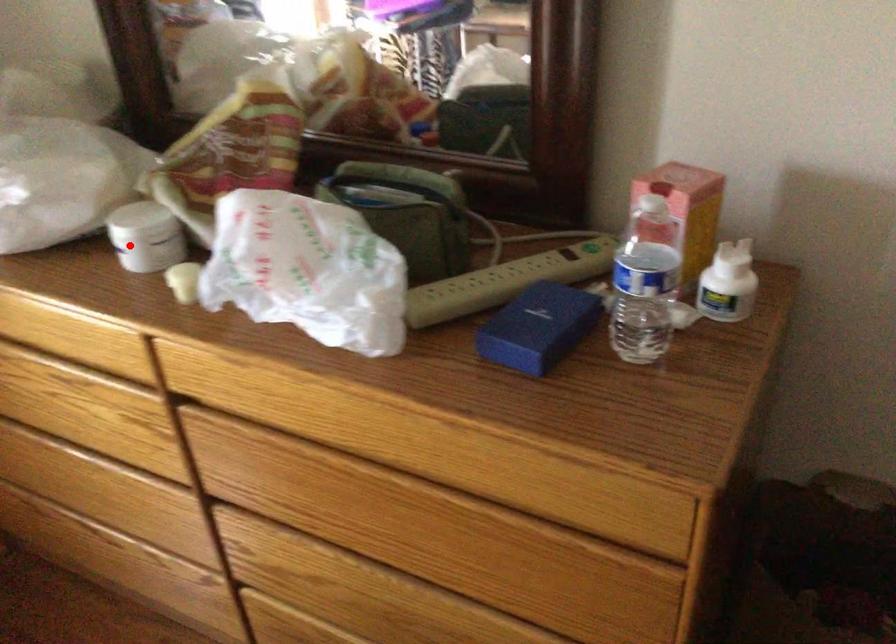
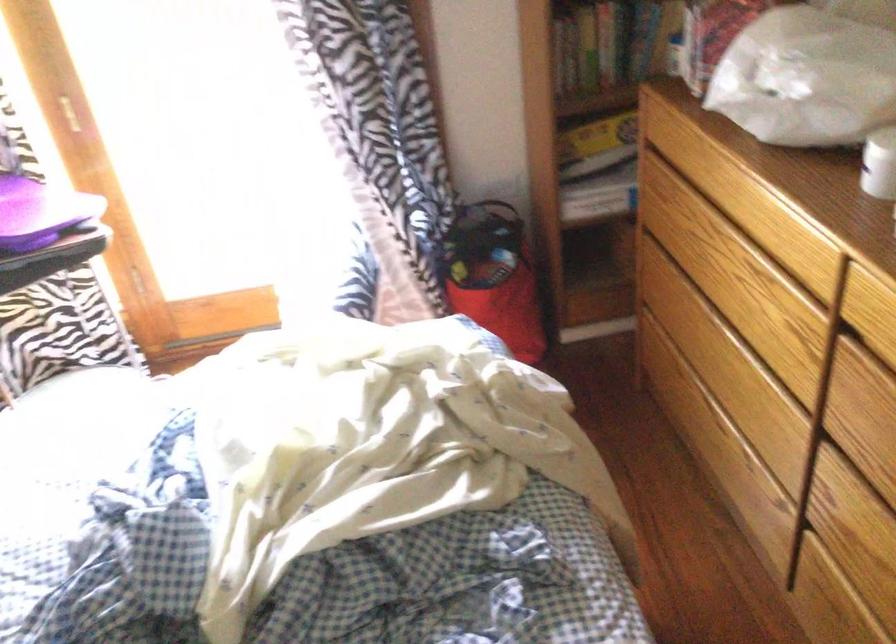
In the second image, find the point that corresponds to the highlighted location in the first image.

(879, 164)